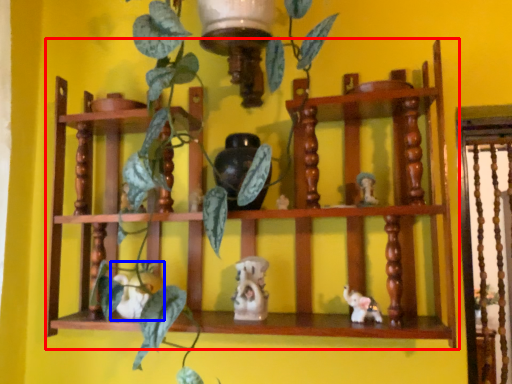
Question: Which of the following is the closest to the observer, shelf (highlighted by a red box) or toy (highlighted by a blue box)?

Choices:
 (A) shelf
 (B) toy

Answer: (A)